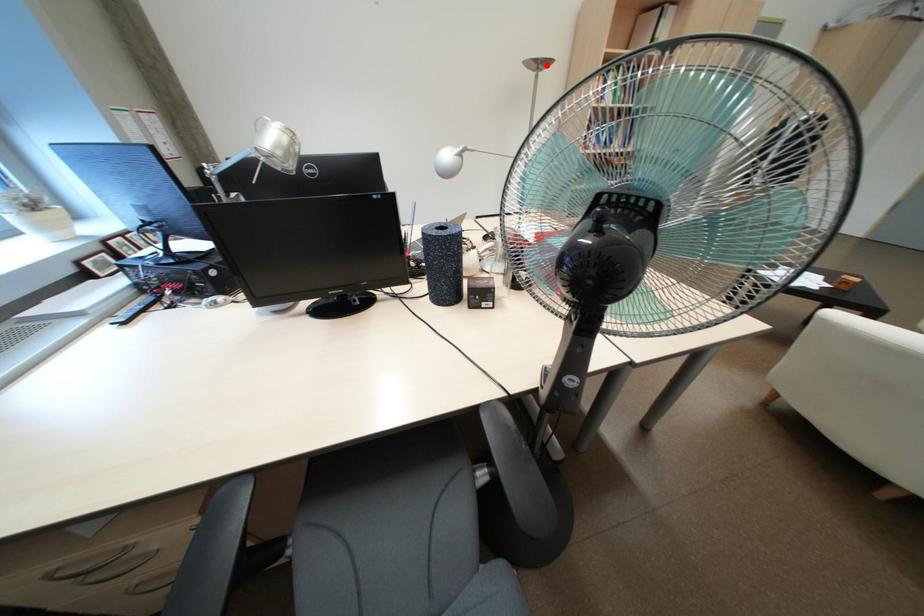
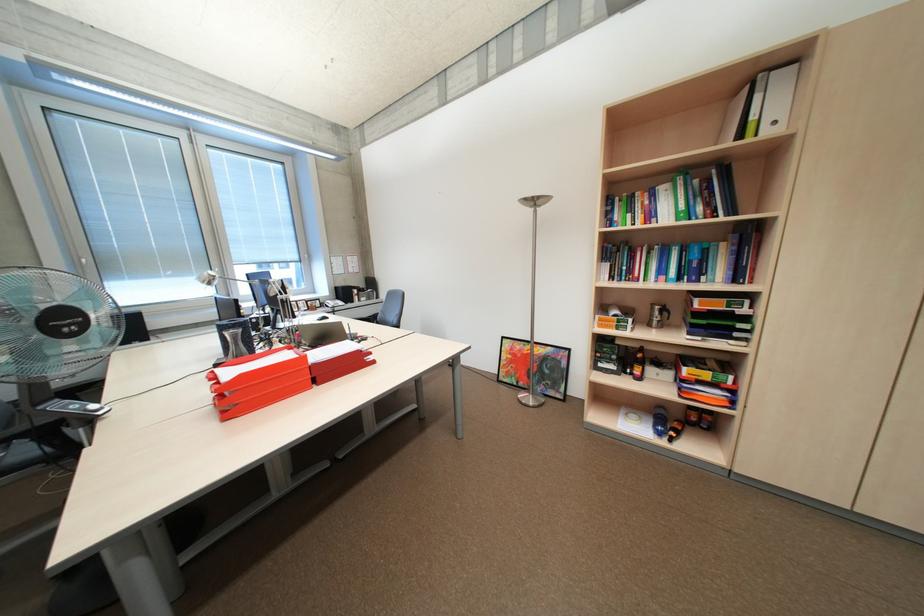
Find the pixel in the second image that matches the highlighted location in the first image.

(542, 203)